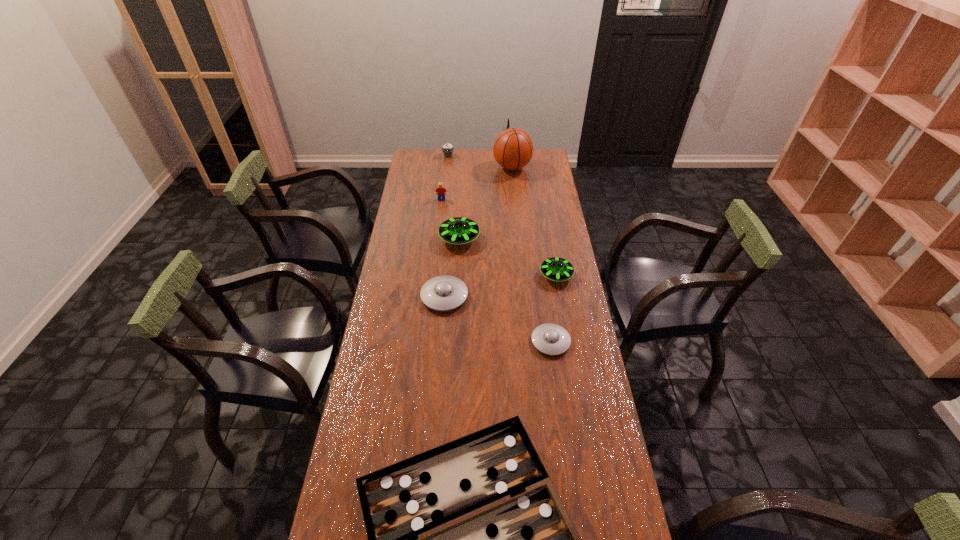
Locate an element on the screen. This screenshot has height=540, width=960. free space that is in between the cupcake and the nearer gray saucer is located at coordinates (499, 248).

Identify the location of vacant point located between the cupcake and the smaller green saucer. The image size is (960, 540). (502, 215).

At what (x,y) coordinates should I click in order to perform the action: click on empty location between the right gray saucer and the smaller green saucer. Please return your answer as a coordinate pair (x, y). This screenshot has width=960, height=540. Looking at the image, I should click on (553, 308).

Find the location of a particular element. free spot between the Lego and the cupcake is located at coordinates (444, 178).

The width and height of the screenshot is (960, 540). In order to click on free spot between the seventh farthest object and the cupcake in this screenshot , I will do `click(499, 248)`.

Find the location of a particular element. The width and height of the screenshot is (960, 540). free area in between the nearer green saucer and the farther gray saucer is located at coordinates (500, 286).

What are the coordinates of `free space that is in between the nearest saucer and the left gray saucer` in the screenshot? It's located at (497, 319).

Choose which object is the nearest neighbor to the basketball. Please provide its 2D coordinates. Your answer should be formatted as a tuple, i.e. [(x, y)], where the tuple contains the x and y coordinates of a point satisfying the conditions above.

[(447, 149)]

Locate which object ranks sixth in proximity to the gameboard. Please provide its 2D coordinates. Your answer should be formatted as a tuple, i.e. [(x, y)], where the tuple contains the x and y coordinates of a point satisfying the conditions above.

[(513, 148)]

Find the location of a particular element. saucer that stands as the third closest to the Lego is located at coordinates pos(557,269).